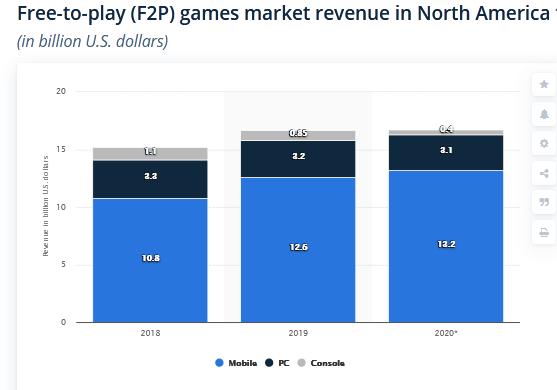
Identify the location of console. This screenshot has width=557, height=390. (320, 360).